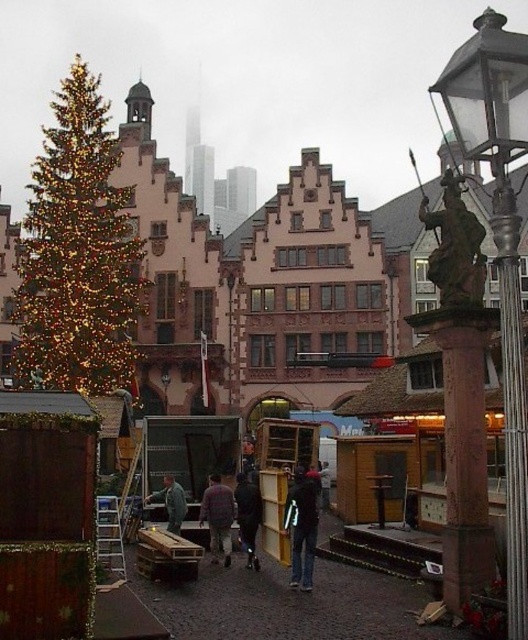
Question: Can you confirm if bronze statue at upper right is bigger than flannel shirt at center?

Choices:
 (A) yes
 (B) no

Answer: (A)

Question: Which point is closer to the camera taking this photo?

Choices:
 (A) (165, 499)
 (B) (64, 378)
 (C) (523, 513)
 (D) (473, 212)

Answer: (C)

Question: Does bronze/brass streetlamp at right have a larger size compared to dark gray jacket at center?

Choices:
 (A) yes
 (B) no

Answer: (A)

Question: Based on their relative distances, which object is nearer to the flannel shirt at center?

Choices:
 (A) bronze/brass streetlamp at right
 (B) dark blue jeans at center

Answer: (B)

Question: Is bronze/brass streetlamp at right thinner than dark gray jacket at center?

Choices:
 (A) yes
 (B) no

Answer: (B)

Question: Considering the real-world distances, which object is farthest from the flannel shirt at center?

Choices:
 (A) smooth reddish-brown stone pillar at center-right
 (B) dark blue jacket at center
 (C) bronze statue at upper right
 (D) shiny gold christmas tree at left

Answer: (C)